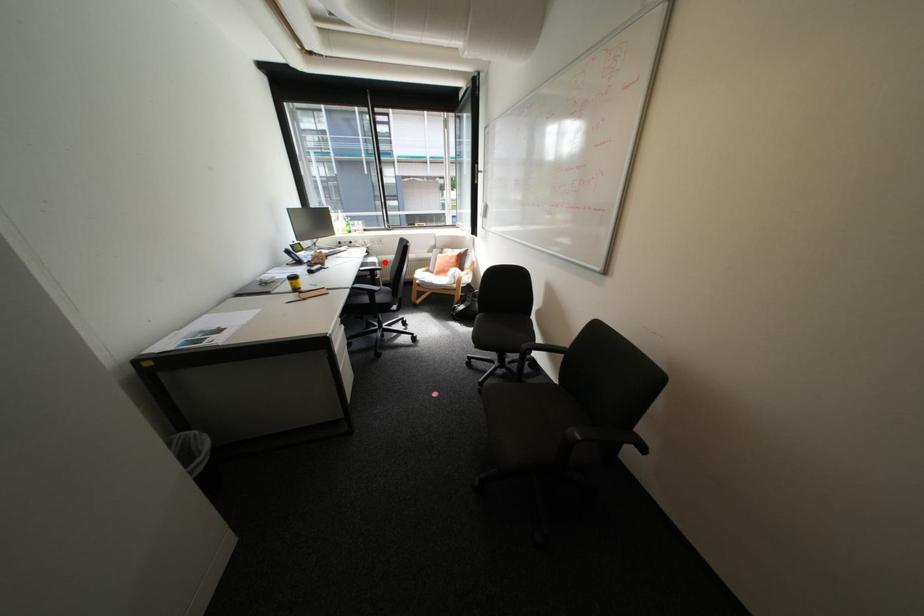
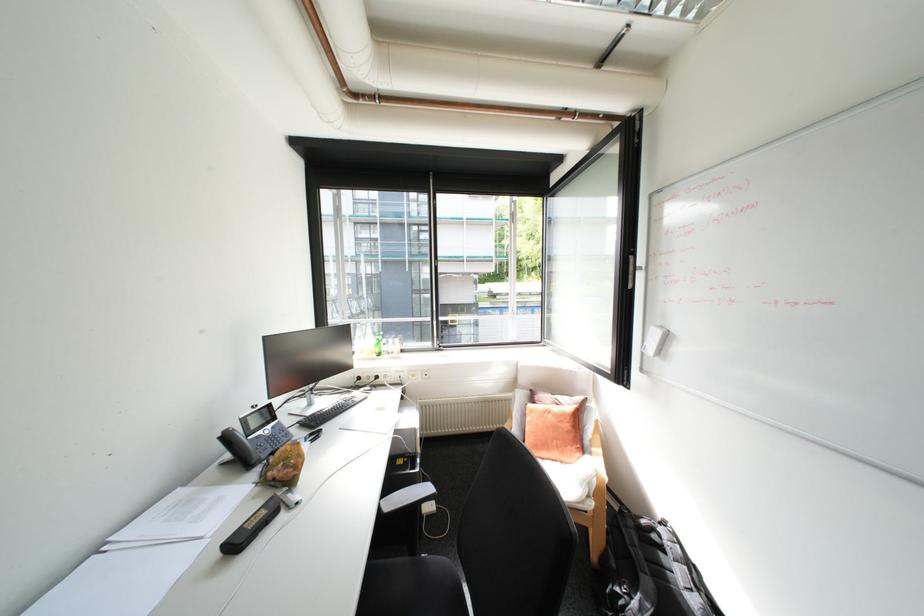
Question: I am providing you with two images of the same scene from different viewpoints. In image1, a red point is highlighted. Considering the same 3D point in image2, which of the following is correct?

Choices:
 (A) It is closer
 (B) It is farther

Answer: (A)